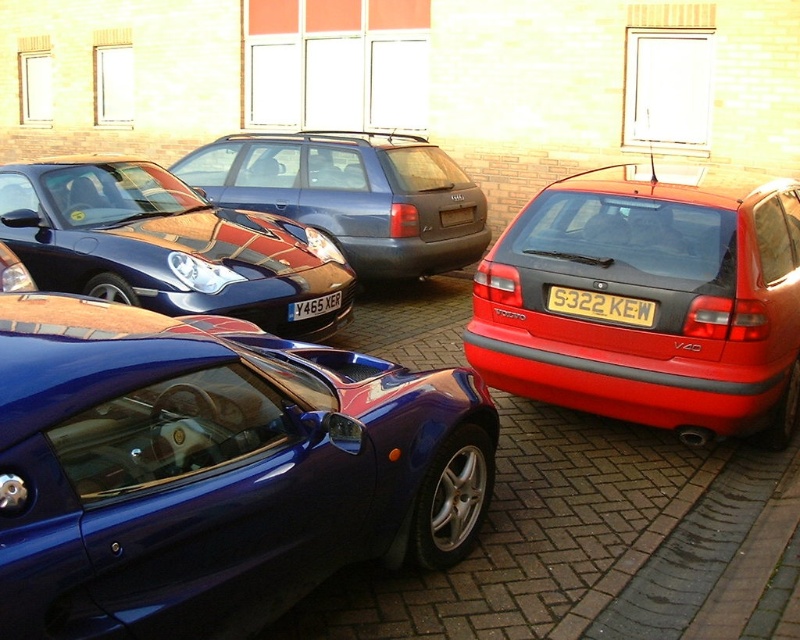
The height and width of the screenshot is (640, 800). What do you see at coordinates (600, 307) in the screenshot? I see `yellow metallic license plate at center` at bounding box center [600, 307].

Which of these two, yellow metallic license plate at center or yellow matte license plate at center, stands shorter?

yellow matte license plate at center

What do you see at coordinates (600, 307) in the screenshot? I see `yellow metallic license plate at center` at bounding box center [600, 307].

Locate an element on the screen. yellow metallic license plate at center is located at coordinates (600, 307).

Is glossy blue sports car at center wider than yellow matte license plate at center?

Yes.

Who is positioned more to the right, glossy blue sports car at center or yellow matte license plate at center?

From the viewer's perspective, glossy blue sports car at center appears more on the right side.

Measure the distance between glossy blue sports car at center and camera.

A distance of 5.50 feet exists between glossy blue sports car at center and camera.

Identify the location of glossy blue sports car at center. This screenshot has height=640, width=800. (214, 468).

Is point (30, 476) behind point (736, 204)?

No, (30, 476) is closer to viewer.

Does glossy blue sports car at center have a larger size compared to glossy red hatchback at right?

Actually, glossy blue sports car at center might be smaller than glossy red hatchback at right.

Does point (132, 566) lie in front of point (724, 385)?

Yes, it is.

Find the location of a particular element. This screenshot has height=640, width=800. glossy blue sports car at center is located at coordinates (214, 468).